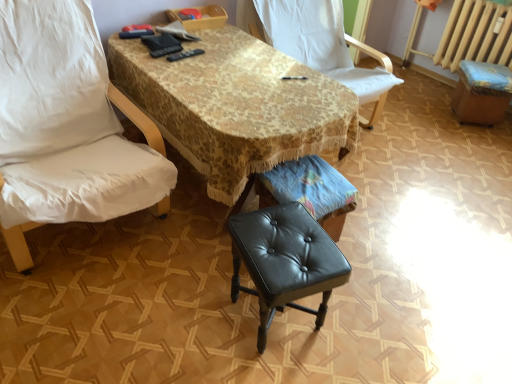
I want to click on free spot to the right of gold lace tablecloth at center, so point(430,220).